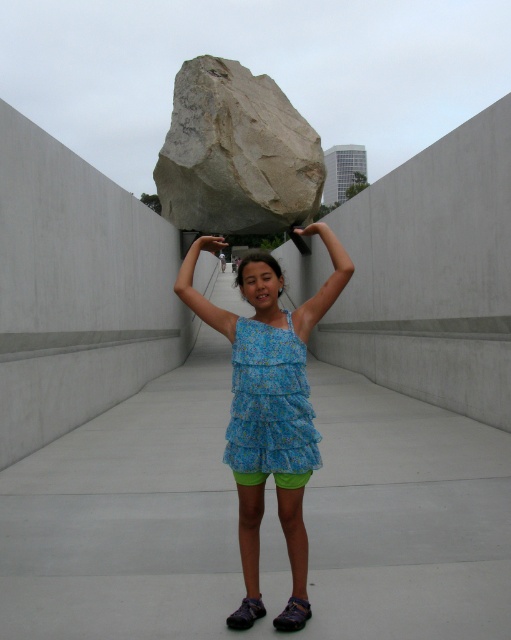
Does gray rough rock at center have a smaller size compared to blue floral dress at center?

Yes.

Is point (247, 224) positioned behind point (328, 301)?

Yes.

Locate an element on the screen. This screenshot has height=640, width=511. gray rough rock at center is located at coordinates (236, 154).

Who is lower down, gray rough rock at center or matte blue dress at center?

matte blue dress at center

What do you see at coordinates (236, 154) in the screenshot? I see `gray rough rock at center` at bounding box center [236, 154].

Where is `gray rough rock at center`? The width and height of the screenshot is (511, 640). gray rough rock at center is located at coordinates (236, 154).

Who is taller, blue floral dress at center or matte blue dress at center?

matte blue dress at center

You are a GUI agent. You are given a task and a screenshot of the screen. Output one action in this format:
    pyautogui.click(x=<x>, y=<y>)
    Task: Click on the blue floral dress at center
    Image resolution: width=511 pixels, height=640 pixels.
    Given the screenshot: What is the action you would take?
    pyautogui.click(x=266, y=339)